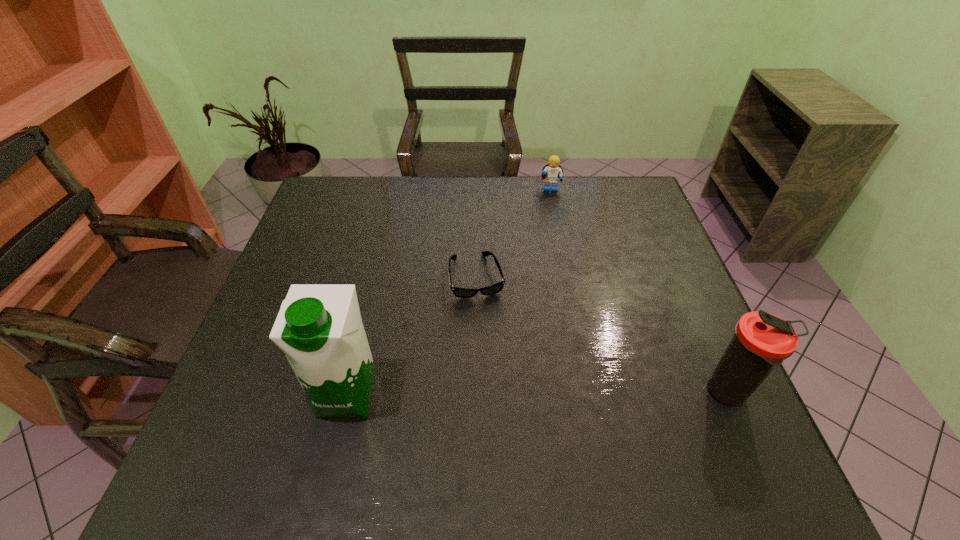
This screenshot has width=960, height=540. Find the location of `soya milk`. soya milk is located at coordinates (319, 328).

Where is `the tallest object`? The image size is (960, 540). the tallest object is located at coordinates (319, 328).

Locate an element on the screen. The width and height of the screenshot is (960, 540). the rightmost object is located at coordinates (762, 341).

Where is `thermos bottle`? thermos bottle is located at coordinates (762, 341).

Identify the location of the shortest object. The height and width of the screenshot is (540, 960). (459, 292).

At what (x,y) coordinates should I click in order to perform the action: click on the second farthest object. Please return your answer as a coordinate pair (x, y). The width and height of the screenshot is (960, 540). Looking at the image, I should click on (459, 292).

The height and width of the screenshot is (540, 960). In order to click on the third tallest object in this screenshot , I will do `click(552, 172)`.

The image size is (960, 540). Identify the location of Lego. (552, 172).

At what (x,y) coordinates should I click in order to perform the action: click on blank space located on the left of the thermos bottle. Please return your answer as a coordinate pair (x, y). Looking at the image, I should click on (593, 394).

What are the coordinates of `vacant space located 0.180m on the front-facing side of the shortest object` in the screenshot? It's located at [495, 360].